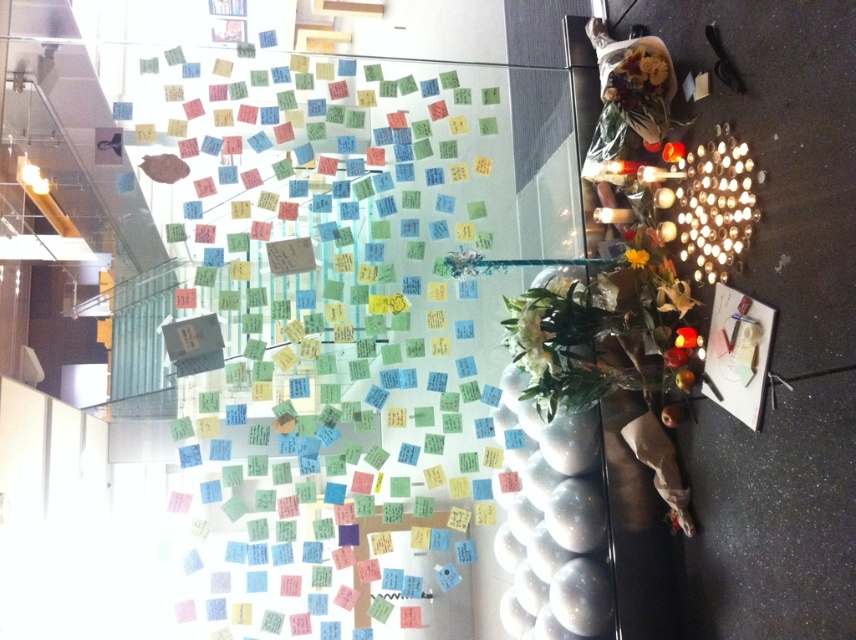
You are a delivery person who needs to place a small package between the colorful paper notes at center and the yellow matte flower at upper center. The package requires at least 3 feet of space. Can you fit it there?

The distance between the colorful paper notes at center and the yellow matte flower at upper center is 3.68 feet, which is more than the required 3 feet. Therefore, the package can be placed there with sufficient space.

You are organizing a meeting in this office space and need to place a new whiteboard. The whiteboard is 1.8 meters tall. There is a spot where you can place it either to the right of the colorful paper notes at center or to the left of the yellow matte flower at upper center. Based on their heights, which side would allow the whiteboard to fit without exceeding the vertical space?

The whiteboard is 1.8 meters tall. The colorful paper notes at center is taller than the yellow matte flower at upper center. Therefore, placing the whiteboard to the right of the colorful paper notes at center would be more appropriate since the existing notes already occupy a taller vertical space, indicating that area can accommodate the whiteboard height. The area left of the yellow matte flower at upper center, being shorter, might not have enough vertical clearance.